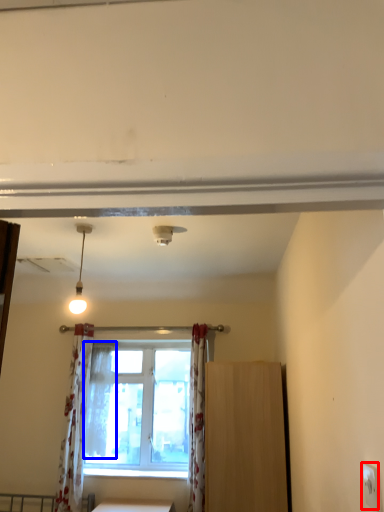
Question: Which point is closer to the camera, electric outlet (highlighted by a red box) or shower curtain (highlighted by a blue box)?

Choices:
 (A) electric outlet
 (B) shower curtain

Answer: (A)